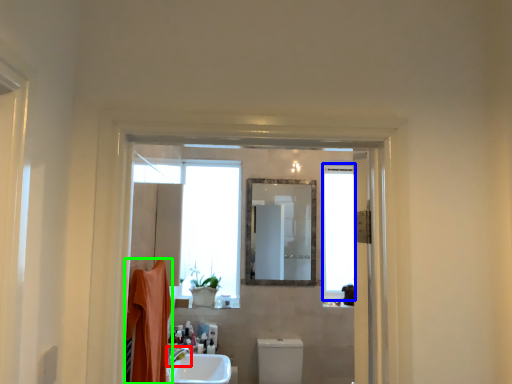
Question: Based on their relative distances, which object is nearer to tap (highlighted by a red box)? Choose from window (highlighted by a blue box) and bath towel (highlighted by a green box).

Choices:
 (A) window
 (B) bath towel

Answer: (B)